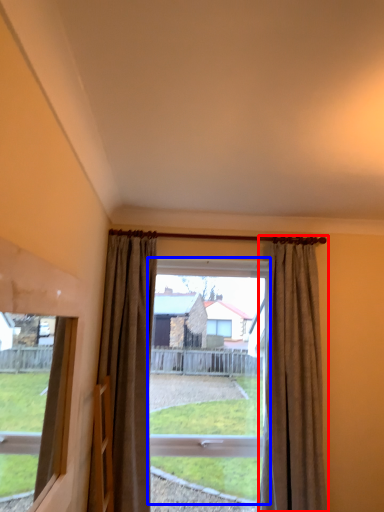
Question: Among these objects, which one is nearest to the camera, curtain (highlighted by a red box) or bay window (highlighted by a blue box)?

Choices:
 (A) curtain
 (B) bay window

Answer: (A)